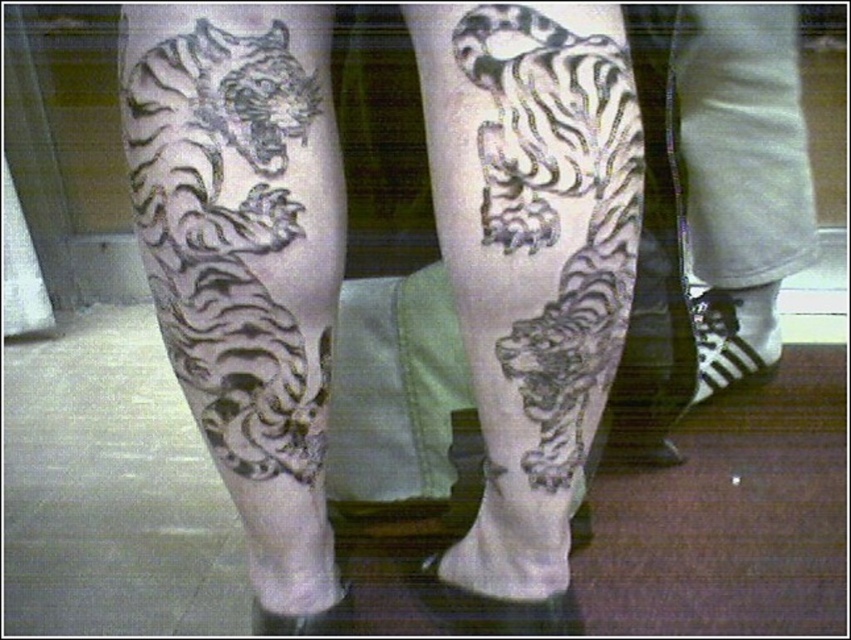
Question: Does black ink tiger at upper left appear on the right side of white cotton socks at lower right?

Choices:
 (A) yes
 (B) no

Answer: (B)

Question: Which of the following is the closest to the observer?

Choices:
 (A) (166, 154)
 (B) (500, 381)

Answer: (A)

Question: Which point is closer to the camera?

Choices:
 (A) black ink tiger at center
 (B) white cotton socks at lower right

Answer: (A)

Question: Is black ink tiger at center below white cotton socks at lower right?

Choices:
 (A) yes
 (B) no

Answer: (A)

Question: Is black ink tiger at center closer to camera compared to white cotton socks at lower right?

Choices:
 (A) no
 (B) yes

Answer: (B)

Question: Among these objects, which one is nearest to the camera?

Choices:
 (A) white cotton socks at lower right
 (B) black ink tiger at center
 (C) black ink tiger at upper left

Answer: (B)